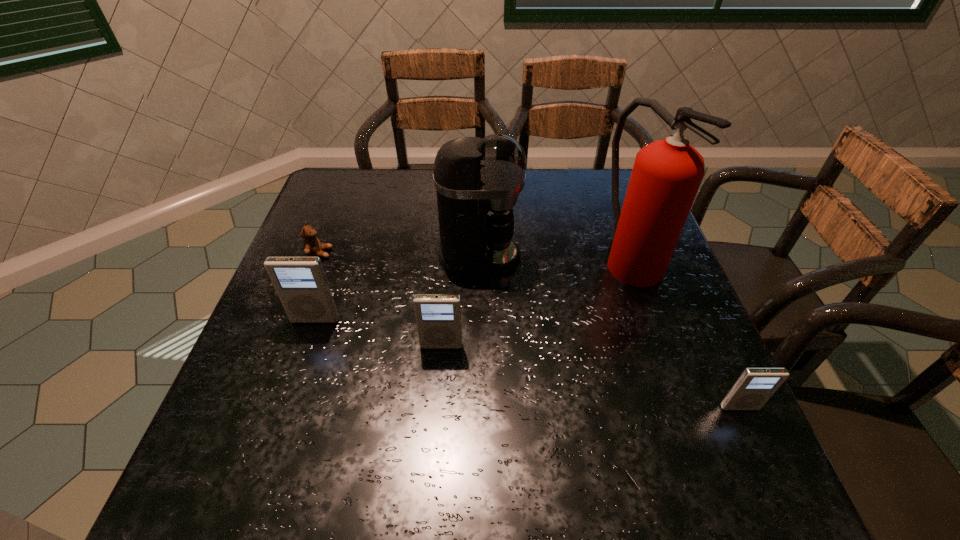
Please determine a free point for an extra iPod to ensure balance. Please provide its 2D coordinates. Your answer should be formatted as a tuple, i.e. [(x, y)], where the tuple contains the x and y coordinates of a point satisfying the conditions above.

[(582, 375)]